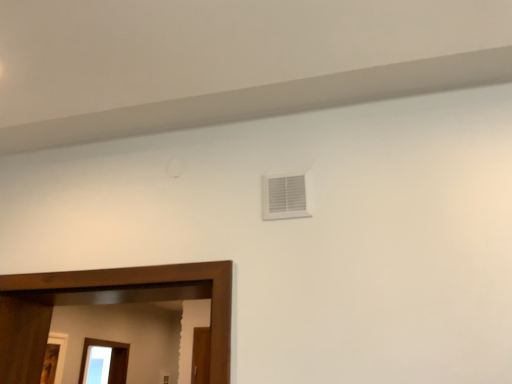
This screenshot has height=384, width=512. What do you see at coordinates (284, 197) in the screenshot? I see `white plastic air conditioning at upper right` at bounding box center [284, 197].

Find the location of a particular element. Image resolution: width=512 pixels, height=384 pixels. white plastic air conditioning at upper right is located at coordinates (284, 197).

In order to face white plastic air conditioning at upper right, should I rotate leftwards or rightwards?

Rotate your view right by about 4.264°.

Find the location of a particular element. white plastic air conditioning at upper right is located at coordinates pyautogui.click(x=284, y=197).